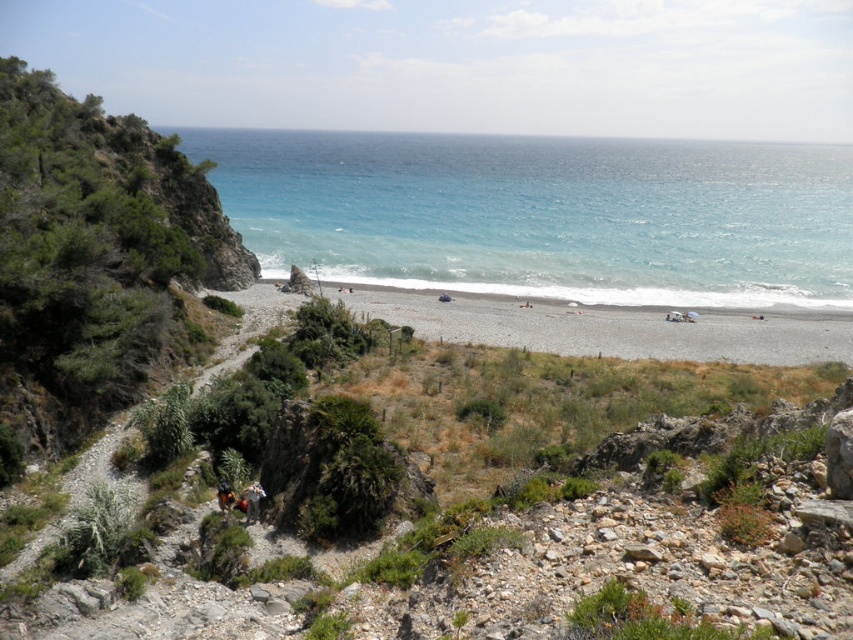
Question: Which point is farther to the camera?

Choices:
 (A) (231, 502)
 (B) (367, 291)
 (C) (260, 484)

Answer: (B)

Question: Can you confirm if green shrubbery at left is thinner than gray gravel beach at center?

Choices:
 (A) yes
 (B) no

Answer: (A)

Question: Which object appears closest to the camera in this image?

Choices:
 (A) camouflage fabric person at lower center
 (B) green shrubbery at left

Answer: (A)

Question: Estimate the real-world distances between objects in this image. Which object is farther from the blue water at center?

Choices:
 (A) gray gravel beach at center
 (B) orange fabric person at lower left
 (C) camouflage fabric person at lower center
 (D) green shrubbery at left

Answer: (B)

Question: Is green shrubbery at left bigger than camouflage fabric person at lower center?

Choices:
 (A) yes
 (B) no

Answer: (A)

Question: Is blue water at center thinner than orange fabric person at lower left?

Choices:
 (A) no
 (B) yes

Answer: (A)